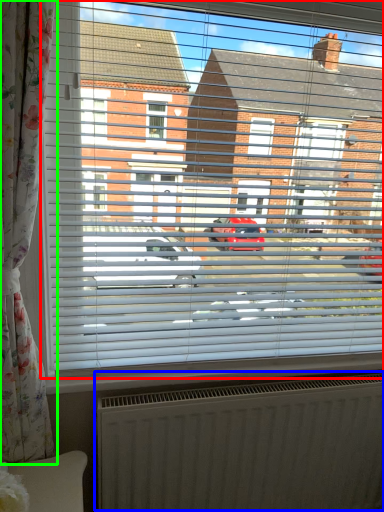
Question: Considering the real-world distances, which object is farthest from window (highlighted by a red box)? radiator (highlighted by a blue box) or curtain (highlighted by a green box)?

Choices:
 (A) radiator
 (B) curtain

Answer: (A)